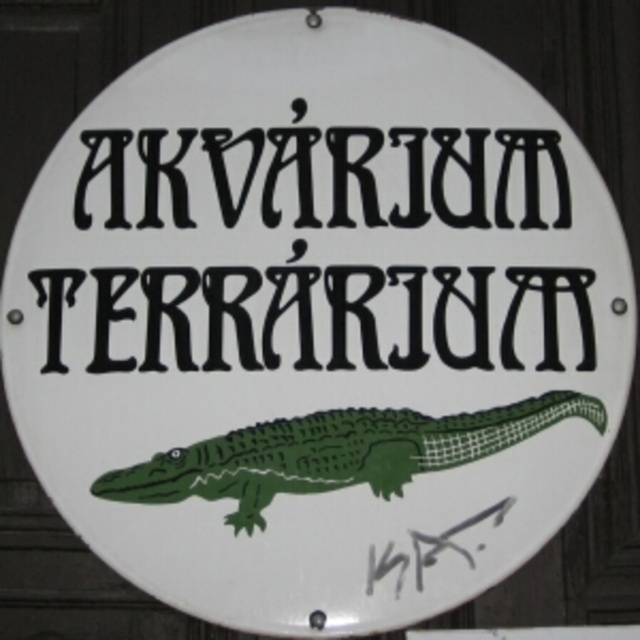
Is blackmaterial/texturetext at upper center positioned behind green matte crocodile at center?

Yes, blackmaterial/texturetext at upper center is further from the viewer.

Can you confirm if blackmaterial/texturetext at upper center is wider than green matte crocodile at center?

No, blackmaterial/texturetext at upper center is not wider than green matte crocodile at center.

Is point (436, 269) closer to viewer compared to point (308, 424)?

No, (436, 269) is further to viewer.

Locate an element on the screen. The height and width of the screenshot is (640, 640). blackmaterial/texturetext at upper center is located at coordinates (323, 179).